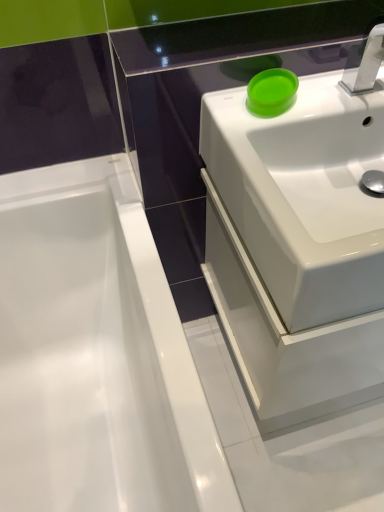
The image size is (384, 512). Find the location of `vacant area that lies to the right of matte green bowl at upper right`. vacant area that lies to the right of matte green bowl at upper right is located at coordinates (330, 95).